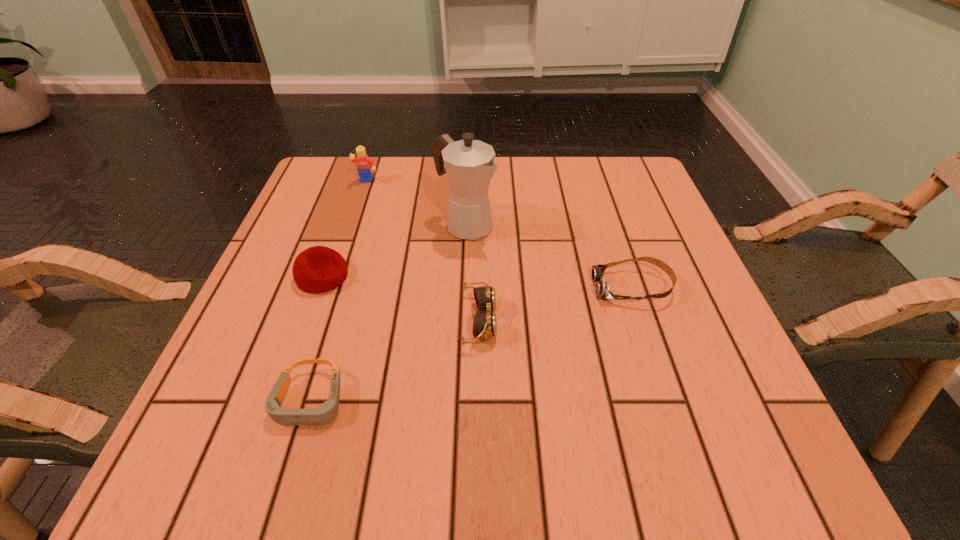
Identify the location of free space that is in between the Lego and the second farthest object. The image size is (960, 540). (416, 203).

Where is `empty space that is in between the second goggles from right to left and the farthest object`? This screenshot has height=540, width=960. empty space that is in between the second goggles from right to left and the farthest object is located at coordinates (423, 251).

This screenshot has height=540, width=960. Identify the location of object that stands as the fifth closest to the Lego. (602, 290).

I want to click on the fourth closest object to the nearest goggles, so click(x=602, y=290).

You are a GUI agent. You are given a task and a screenshot of the screen. Output one action in this format:
    pyautogui.click(x=<x>, y=<y>)
    Task: Click on the third closest goggles to the second tallest object
    Image resolution: width=960 pixels, height=540 pixels.
    Given the screenshot: What is the action you would take?
    pyautogui.click(x=602, y=290)

Point out which goggles is positioned as the nearest to the beanbag. Please provide its 2D coordinates. Your answer should be formatted as a tuple, i.e. [(x, y)], where the tuple contains the x and y coordinates of a point satisfying the conditions above.

[(326, 412)]

The height and width of the screenshot is (540, 960). I want to click on vacant area that satisfies the following two spatial constraints: 1. on the front-facing side of the rightmost goggles; 2. on the front and back of the nearest object, so click(x=670, y=401).

The image size is (960, 540). I want to click on free space that satisfies the following two spatial constraints: 1. through the lenses of the second goggles from left to right; 2. on the front and back of the leftmost goggles, so click(480, 401).

You are a GUI agent. You are given a task and a screenshot of the screen. Output one action in this format:
    pyautogui.click(x=<x>, y=<y>)
    Task: Click on the vacant space that satisfies the following two spatial constraints: 1. on the front-facing side of the rightmost goggles; 2. on the front and back of the shortest goggles
    This screenshot has height=540, width=960.
    Given the screenshot: What is the action you would take?
    pyautogui.click(x=670, y=401)

The width and height of the screenshot is (960, 540). I want to click on vacant space that satisfies the following two spatial constraints: 1. on the face of the Lego; 2. on the seat area of the beanbag, so click(x=336, y=276).